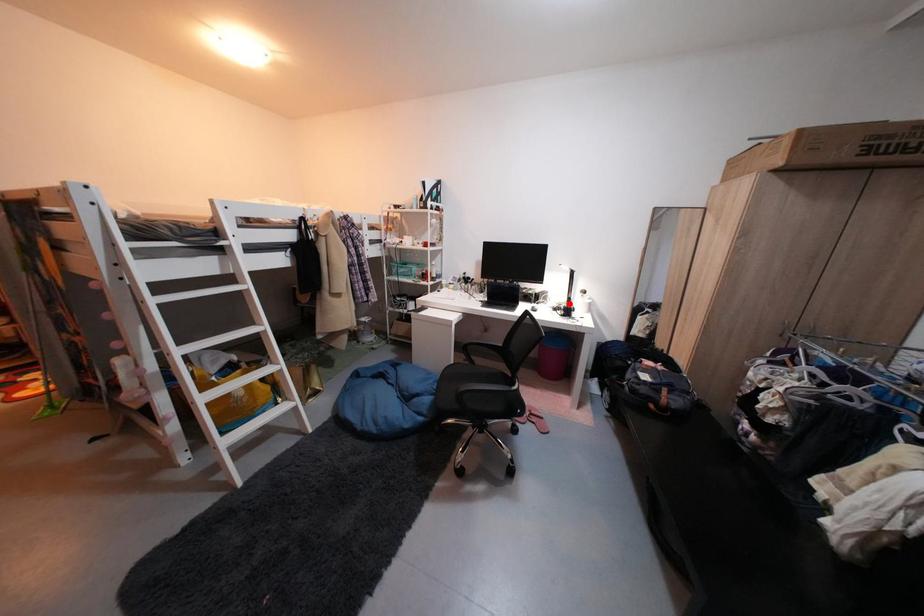
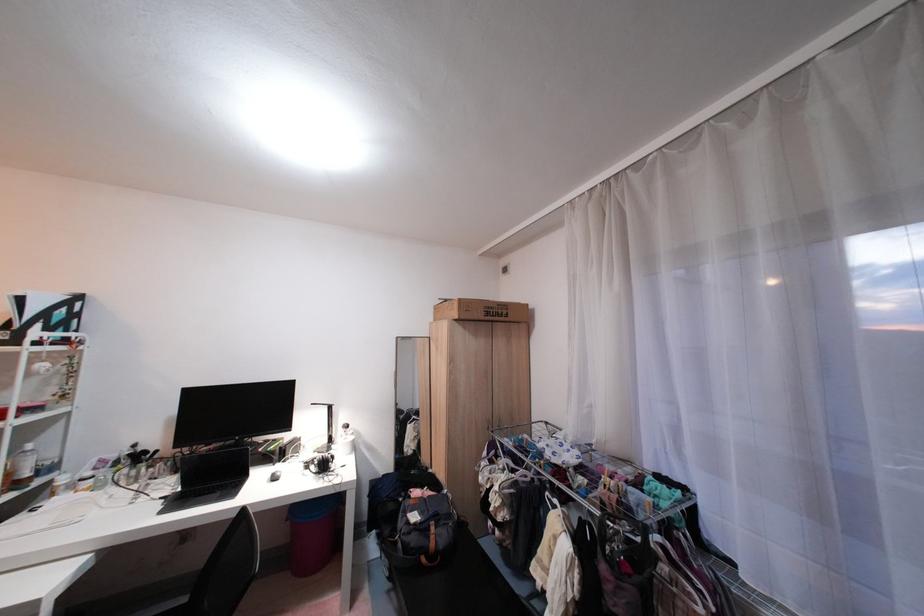
Question: I am providing you with two images of the same scene from different viewpoints. A red point is shown in image1. For the corresponding object point in image2, is it positioned nearer or farther from the camera?

Choices:
 (A) Nearer
 (B) Farther

Answer: (B)